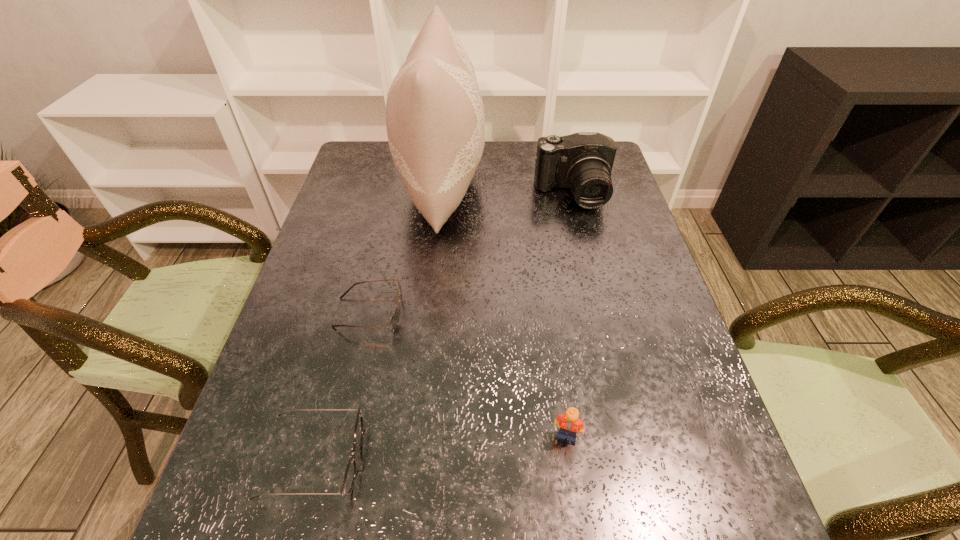
Identify the location of blank region between the sunglasses and the spectacles. Image resolution: width=960 pixels, height=540 pixels. pyautogui.click(x=342, y=386).

This screenshot has height=540, width=960. I want to click on vacant space in between the cushion and the Lego, so click(x=505, y=310).

Locate an element on the screen. The image size is (960, 540). free spot between the Lego and the spectacles is located at coordinates point(440,447).

I want to click on free space between the sunglasses and the spectacles, so click(342, 386).

You are a GUI agent. You are given a task and a screenshot of the screen. Output one action in this format:
    pyautogui.click(x=<x>, y=<y>)
    Task: Click on the free space that is in between the cushion and the sunglasses
    The width and height of the screenshot is (960, 540).
    Given the screenshot: What is the action you would take?
    pyautogui.click(x=406, y=249)

The height and width of the screenshot is (540, 960). Find the location of `free space between the cushion and the spectacles`. free space between the cushion and the spectacles is located at coordinates (378, 323).

The width and height of the screenshot is (960, 540). I want to click on vacant space in between the spectacles and the cushion, so click(x=378, y=323).

Locate an element on the screen. This screenshot has width=960, height=540. empty space between the sunglasses and the spectacles is located at coordinates (342, 386).

Locate an element on the screen. free space between the fourth shortest object and the spectacles is located at coordinates (x=444, y=327).

Locate an element on the screen. empty space between the spectacles and the second tallest object is located at coordinates (444, 327).